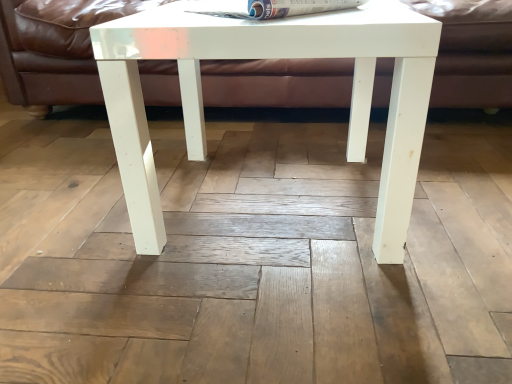
Question: From their relative heights in the image, would you say white glossy table at center is taller or shorter than white glossy magazine at upper center?

Choices:
 (A) tall
 (B) short

Answer: (A)

Question: Based on their sizes in the image, would you say white glossy table at center is bigger or smaller than white glossy magazine at upper center?

Choices:
 (A) small
 (B) big

Answer: (B)

Question: Which object is positioned farthest from the matte brown leather couch at upper center?

Choices:
 (A) white glossy table at center
 (B) white glossy magazine at upper center

Answer: (B)

Question: Which of these objects is positioned farthest from the white glossy table at center?

Choices:
 (A) matte brown leather couch at upper center
 (B) white glossy magazine at upper center

Answer: (A)